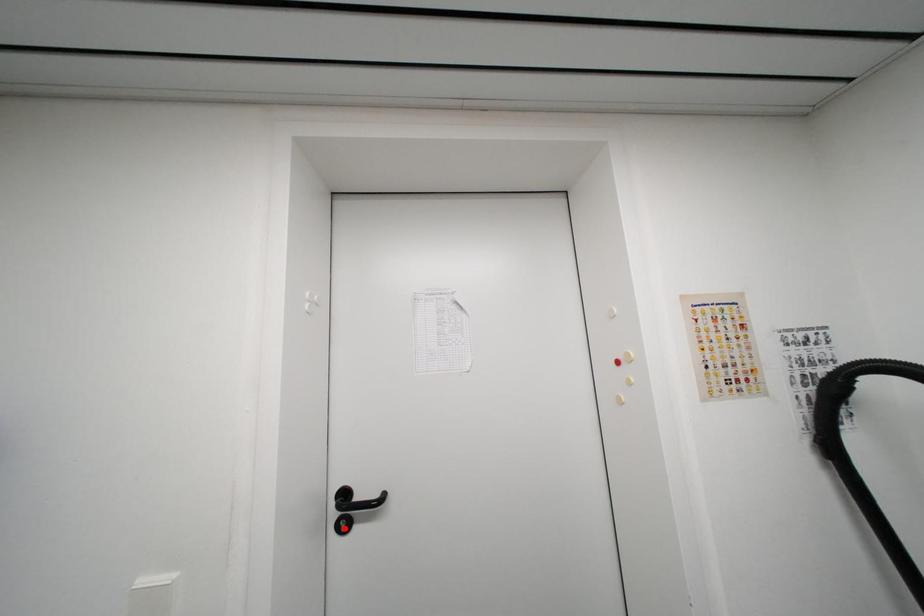
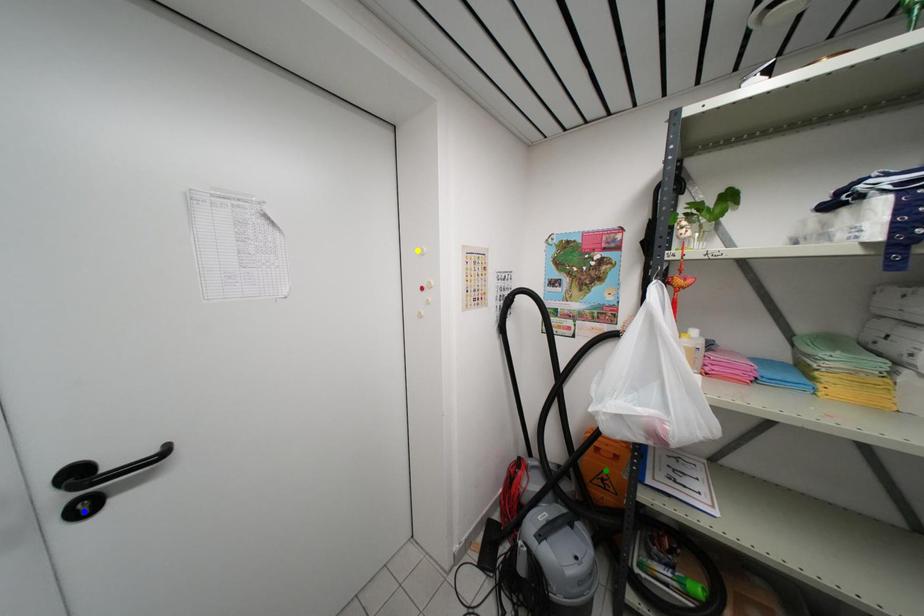
Question: I am providing you with two images of the same scene from different viewpoints. A red point is marked on the first image. You are given multiple points on the second image. Which mark in image 2 goes with the point in image 1?

Choices:
 (A) green point
 (B) yellow point
 (C) blue point

Answer: (C)